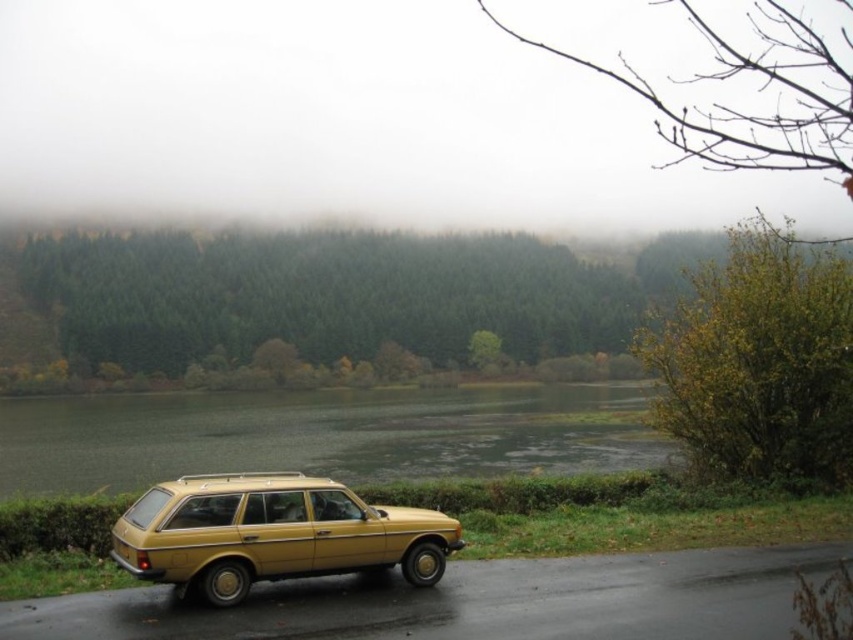
Question: Does green matte water at center have a larger size compared to gold matte station wagon at lower left?

Choices:
 (A) yes
 (B) no

Answer: (A)

Question: Considering the relative positions of green matte water at center and gold matte station wagon at lower left in the image provided, where is green matte water at center located with respect to gold matte station wagon at lower left?

Choices:
 (A) below
 (B) above

Answer: (A)

Question: Which of the following is the farthest from the observer?

Choices:
 (A) (27, 440)
 (B) (344, 545)

Answer: (A)

Question: Which of the following is the farthest from the observer?

Choices:
 (A) (352, 509)
 (B) (271, 467)

Answer: (B)

Question: Can you confirm if green matte water at center is wider than gold matte station wagon at lower left?

Choices:
 (A) no
 (B) yes

Answer: (B)